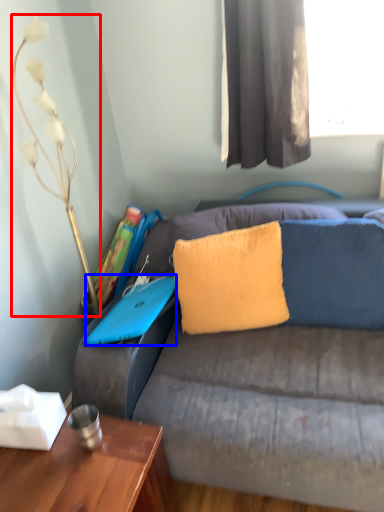
Question: Which of the following is the farthest to the observer, lamp (highlighted by a red box) or laptop (highlighted by a blue box)?

Choices:
 (A) lamp
 (B) laptop

Answer: (B)